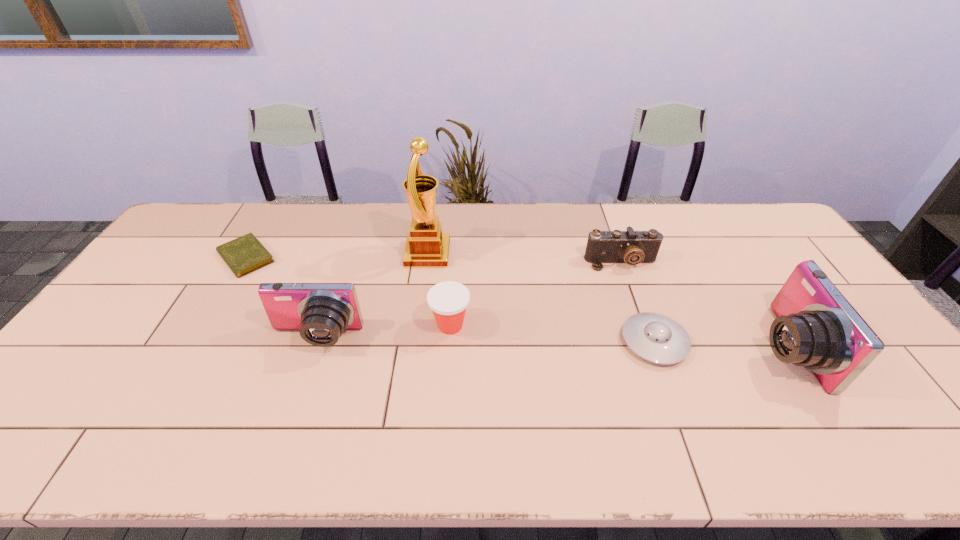
Locate an element on the screen. The image size is (960, 540). vacant space that satisfies the following two spatial constraints: 1. on the front-facing side of the award; 2. on the back side of the Dixie cup is located at coordinates (418, 325).

The width and height of the screenshot is (960, 540). Find the location of `free region that satisfies the following two spatial constraints: 1. on the front-facing side of the leftmost camera; 2. on the left side of the saucer`. free region that satisfies the following two spatial constraints: 1. on the front-facing side of the leftmost camera; 2. on the left side of the saucer is located at coordinates (314, 342).

Where is `free point that satisfies the following two spatial constraints: 1. on the front side of the shortest object; 2. on the right side of the Dixie cup`? The height and width of the screenshot is (540, 960). free point that satisfies the following two spatial constraints: 1. on the front side of the shortest object; 2. on the right side of the Dixie cup is located at coordinates (205, 325).